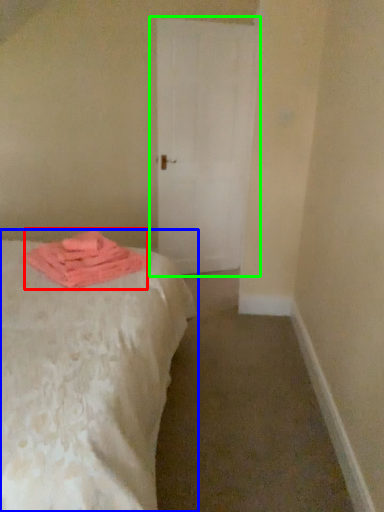
Question: Which is nearer to the material (highlighted by a red box)? bed (highlighted by a blue box) or door (highlighted by a green box).

Choices:
 (A) bed
 (B) door

Answer: (A)